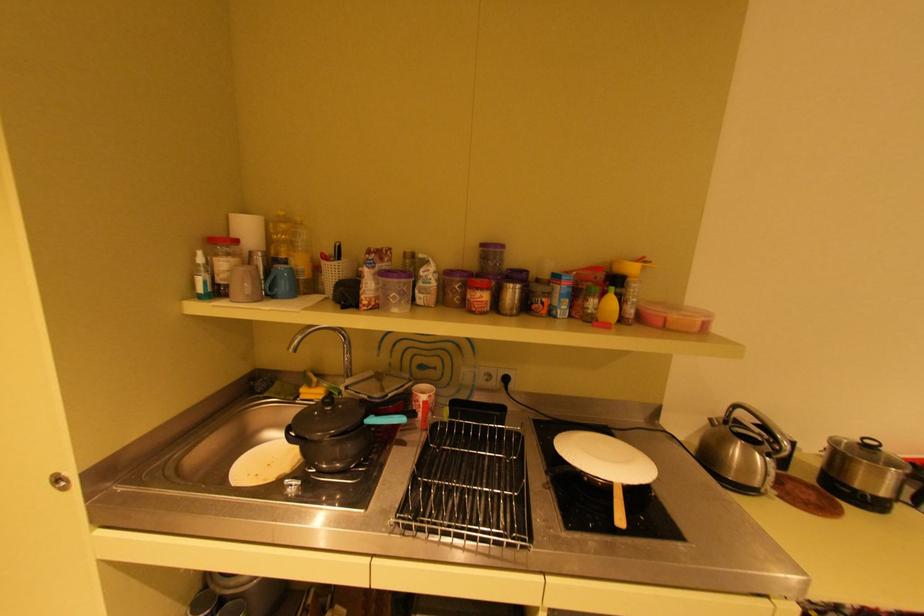
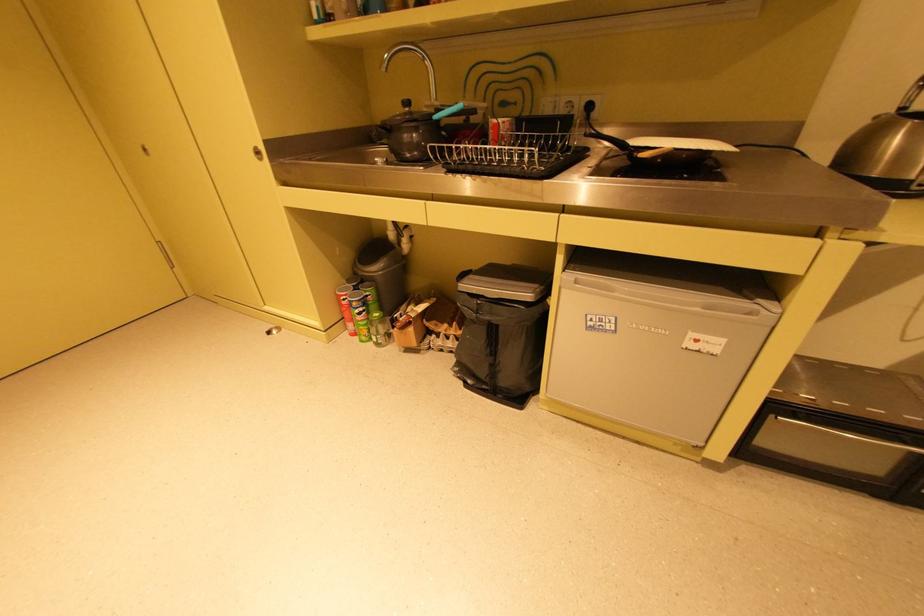
Based on the continuous images, in which direction is the camera rotating?

The camera rotated toward left-down.